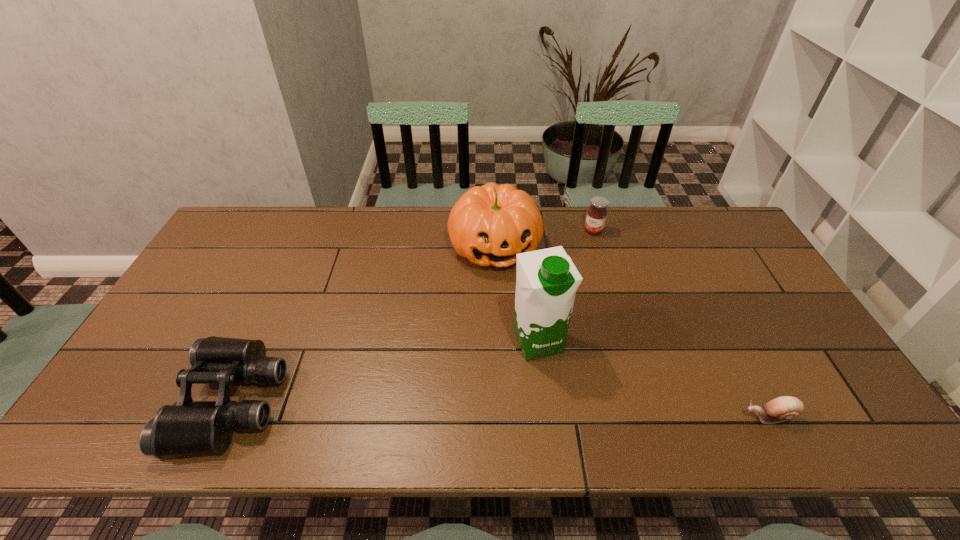
Where is `blank space located on the carved face of the fourth shortest object`? This screenshot has width=960, height=540. blank space located on the carved face of the fourth shortest object is located at coordinates (521, 322).

Where is `free spot located 0.100m on the front-facing side of the tallest object`? The image size is (960, 540). free spot located 0.100m on the front-facing side of the tallest object is located at coordinates (564, 397).

Where is `free location located on the label side of the jam`? The width and height of the screenshot is (960, 540). free location located on the label side of the jam is located at coordinates (569, 267).

Find the location of a particular element. This screenshot has width=960, height=540. free space located 0.090m on the label side of the jam is located at coordinates (580, 251).

This screenshot has height=540, width=960. What are the coordinates of `blank space located 0.400m on the label side of the jam` in the screenshot? It's located at (540, 313).

This screenshot has width=960, height=540. I want to click on pumpkin at the far edge, so click(x=489, y=225).

What are the coordinates of `jam positioned at the far edge` in the screenshot? It's located at (596, 216).

Locate an element on the screen. binoculars that is at the near edge is located at coordinates (188, 427).

Locate an element on the screen. escargot located in the near edge section of the desktop is located at coordinates (783, 408).

The width and height of the screenshot is (960, 540). What are the coordinates of `object present at the right edge` in the screenshot? It's located at (783, 408).